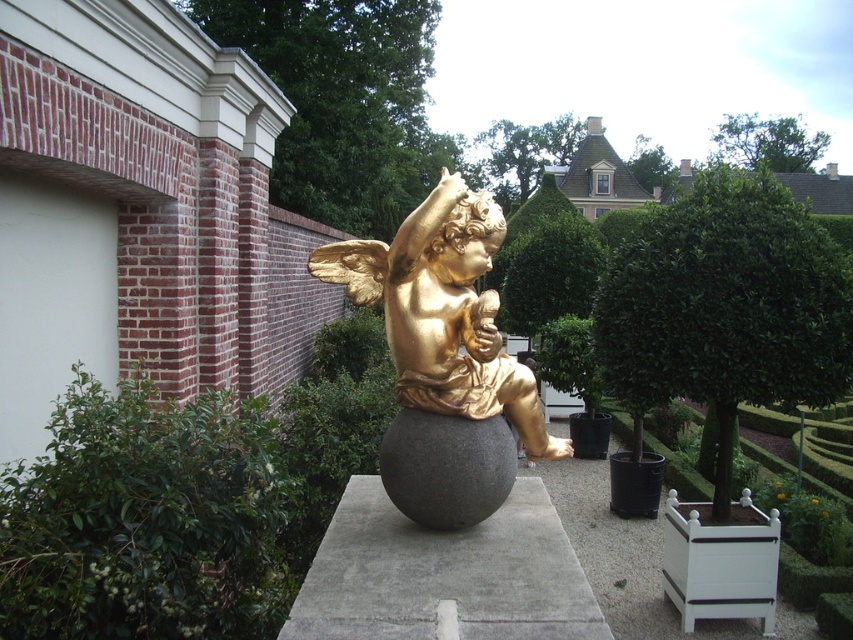
Based on the photo, you are a landscape architect designing a garden pathway. You need to place a decorative item on the gray concrete at center so that it won not be obscured by the gold polished statue at center. Where should you position it?

The gold polished statue at center is located above the gray concrete at center, so placing the decorative item on the gray concrete at center to the side or behind the statue would ensure it remains visible and not obscured.

You are standing in the garden and want to take a photo of the golden statue of an angel. The statue is located at point (196, 428). If your camera can focus on objects within 2 meters, will you be able to capture a clear photo of the statue?

The distance between point (196, 428) and the camera is 2.43 meters. Since the camera can only focus within 2 meters, you will not be able to capture a clear photo of the statue as it is beyond the camera focus range.

You are a gardener planning to plant a new row of flowers between the green leafy hedge at left and the gray concrete at center. Given their sizes, which object should you place the flowers closer to for better visibility?

The green leafy hedge at left is larger in size than the gray concrete at center, so placing the flowers closer to the gray concrete at center would ensure better visibility as they won